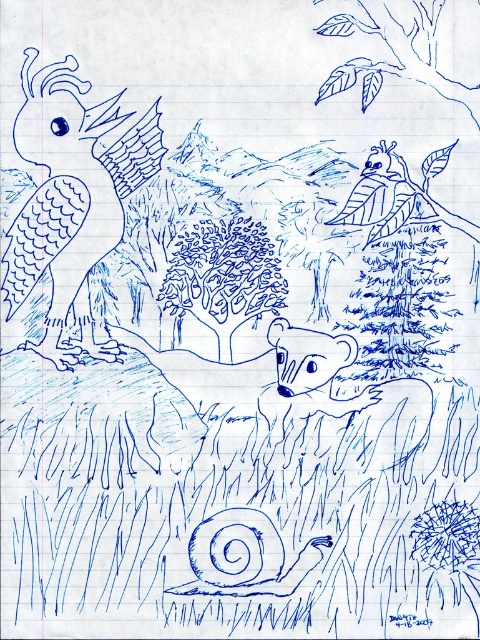
Between blue line art tree at upper center and blue sketchy bird at upper center, which one has less height?

Standing shorter between the two is blue sketchy bird at upper center.

The height and width of the screenshot is (640, 480). Describe the element at coordinates (396, 54) in the screenshot. I see `blue line art tree at upper center` at that location.

This screenshot has height=640, width=480. What are the coordinates of `blue line art tree at upper center` in the screenshot? It's located at (396, 54).

Looking at this image, who is lower down, matte blue bird at upper left or blue sketchy bird at upper center?

matte blue bird at upper left

Can you confirm if matte blue bird at upper left is taller than blue sketchy bird at upper center?

Correct, matte blue bird at upper left is much taller as blue sketchy bird at upper center.

Is point (62, 205) positioned before point (417, 202)?

Yes, point (62, 205) is closer to viewer.

The width and height of the screenshot is (480, 640). Find the location of `matte blue bird at upper left`. matte blue bird at upper left is located at coordinates (72, 202).

Can you confirm if matte blue bird at upper left is positioned above blue line art tree at upper center?

Incorrect, matte blue bird at upper left is not positioned above blue line art tree at upper center.

Which is below, matte blue bird at upper left or blue line art tree at upper center?

Positioned lower is matte blue bird at upper left.

Image resolution: width=480 pixels, height=640 pixels. I want to click on matte blue bird at upper left, so click(x=72, y=202).